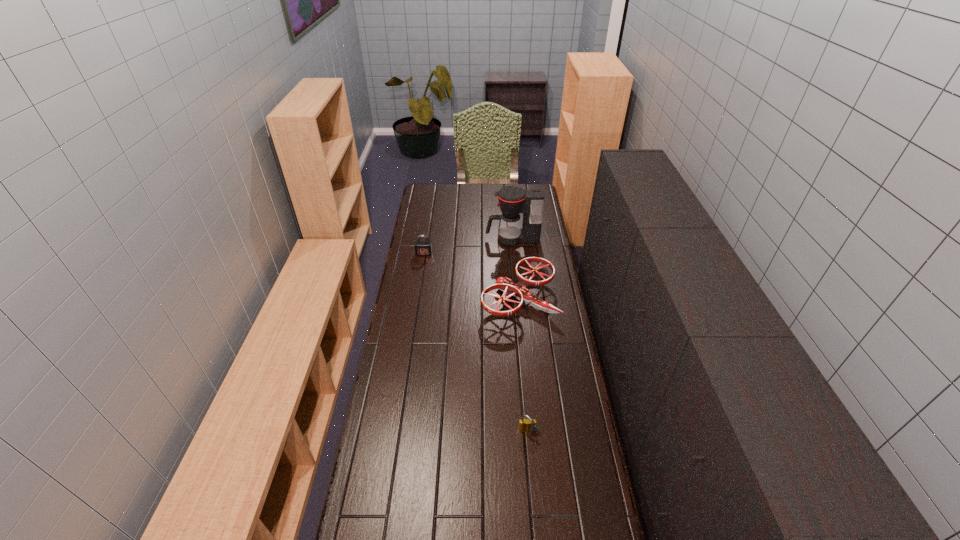
Image resolution: width=960 pixels, height=540 pixels. Find the location of `free space between the third farthest object and the leftmost object`. free space between the third farthest object and the leftmost object is located at coordinates (471, 276).

Locate an element on the screen. The image size is (960, 540). empty space that is in between the left padlock and the third farthest object is located at coordinates (471, 276).

Locate an element on the screen. object that ranks as the third closest to the farther padlock is located at coordinates (526, 425).

Identify the location of the second closest object relative to the tallest object. The width and height of the screenshot is (960, 540). (422, 248).

Locate an element on the screen. The height and width of the screenshot is (540, 960). vacant point that satisfies the following two spatial constraints: 1. on the front of the drone near the keyhole; 2. on the left side of the farther padlock is located at coordinates (417, 299).

Where is `free space in the image that satisfies the following two spatial constraints: 1. on the front of the leftmost object near the keyhole; 2. on the right side of the second nearest object`? This screenshot has width=960, height=540. free space in the image that satisfies the following two spatial constraints: 1. on the front of the leftmost object near the keyhole; 2. on the right side of the second nearest object is located at coordinates (417, 299).

In order to click on free location that satisfies the following two spatial constraints: 1. on the front of the farther padlock near the keyhole; 2. on the right side of the third farthest object in this screenshot , I will do `click(417, 299)`.

You are a GUI agent. You are given a task and a screenshot of the screen. Output one action in this format:
    pyautogui.click(x=<x>, y=<y>)
    Task: Click on the vacant region that satisfies the following two spatial constraints: 1. pour from the carafe of the farthest object; 2. on the front of the second farthest object near the keyhole
    The image size is (960, 540).
    Given the screenshot: What is the action you would take?
    pyautogui.click(x=514, y=254)

Locate an element on the screen. This screenshot has width=960, height=540. vacant space that satisfies the following two spatial constraints: 1. pour from the carafe of the farthest object; 2. on the front of the left padlock near the keyhole is located at coordinates (514, 254).

Where is `free space in the image that satisfies the following two spatial constraints: 1. on the front of the drone near the keyhole; 2. on the right side of the farther padlock`? The height and width of the screenshot is (540, 960). free space in the image that satisfies the following two spatial constraints: 1. on the front of the drone near the keyhole; 2. on the right side of the farther padlock is located at coordinates (417, 299).